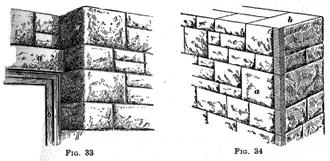
Where is `doorway`? The width and height of the screenshot is (330, 161). doorway is located at coordinates (13, 75), (37, 75), (49, 77), (49, 90), (50, 120).